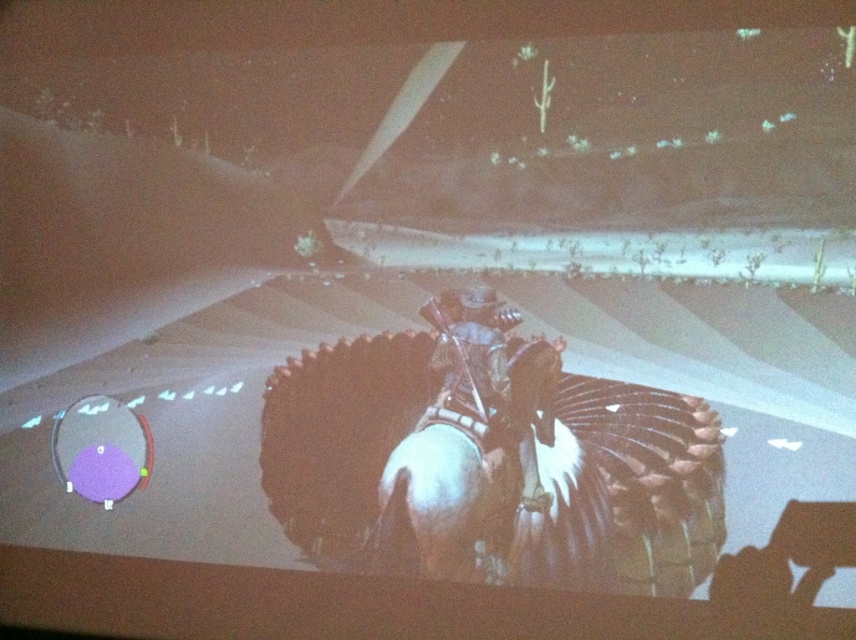
You are a game developer designing a level where the white matte horse at center and the metallic armor at center must be placed in a desert scene. According to the game design rules, the horse must be positioned to the left of the armor. Does the current arrangement in the image comply with this rule?

Yes, the current arrangement complies with the rule because the white matte horse at center is positioned on the left side of metallic armor at center, as required.

You are a game developer checking the positioning of the white matte horse at center and the metallic armor at center in the game scene. The minimum safe distance between these two objects to prevent collision is 15 centimeters. Is the current distance sufficient?

The white matte horse at center is 14.92 centimeters from metallic armor at center, which is slightly less than the required 15 centimeters. Therefore, the current distance is insufficient to prevent collision.